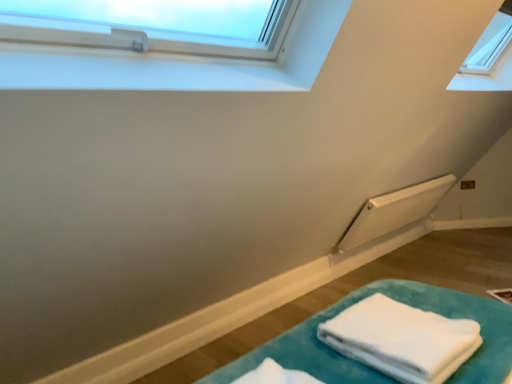
I want to click on white soft towel at lower right, so click(401, 339).

What do you see at coordinates (401, 339) in the screenshot?
I see `white soft towel at lower right` at bounding box center [401, 339].

Identify the location of white soft towel at lower right. The height and width of the screenshot is (384, 512). (401, 339).